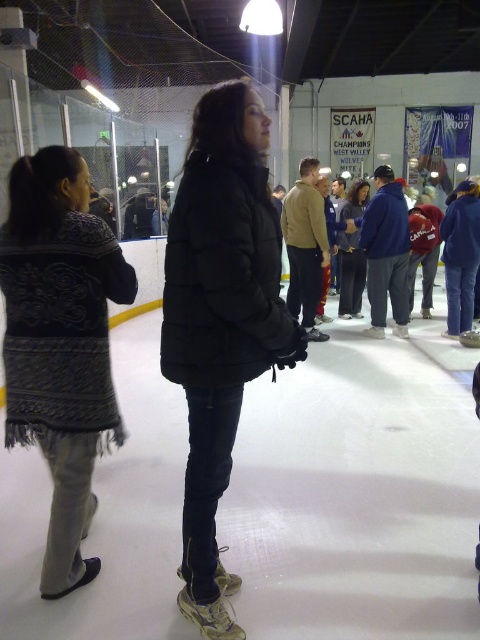
Question: Which of the following is the farthest from the observer?

Choices:
 (A) (343, 236)
 (B) (257, 160)
 (C) (24, 273)

Answer: (A)

Question: Which object is the farthest from the matte black jacket at center?

Choices:
 (A) dark gray knitted sweater at left
 (B) black puffer jacket at center

Answer: (B)

Question: Does black puffer jacket at center have a lesser width compared to dark gray knitted sweater at left?

Choices:
 (A) yes
 (B) no

Answer: (A)

Question: Is dark gray knitted sweater at left below matte black jacket at center?

Choices:
 (A) no
 (B) yes

Answer: (B)

Question: Which object appears closest to the camera in this image?

Choices:
 (A) matte black jacket at center
 (B) black puffer jacket at center

Answer: (B)

Question: Is the position of black puffer jacket at center more distant than that of dark gray knitted sweater at left?

Choices:
 (A) no
 (B) yes

Answer: (A)